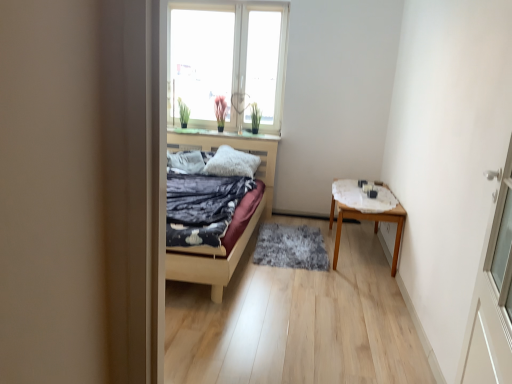
The image size is (512, 384). What do you see at coordinates (291, 247) in the screenshot? I see `gray shaggy rug at center` at bounding box center [291, 247].

The height and width of the screenshot is (384, 512). Describe the element at coordinates (232, 163) in the screenshot. I see `white fluffy pillow at center, positioned as the 2th pillow in left-to-right order` at that location.

Measure the distance between point (x=182, y=157) and camera.

4.59 meters.

Describe the element at coordinates (221, 134) in the screenshot. The width and height of the screenshot is (512, 384). I see `white glossy window sill at upper center` at that location.

Find the location of `gray shaggy rug at center`. gray shaggy rug at center is located at coordinates (291, 247).

Is white textured table at right not near white glossy window sill at upper center?

Yes, white textured table at right is far from white glossy window sill at upper center.

Where is `window sill above the white textured table at right (from a real-world perspective)`? window sill above the white textured table at right (from a real-world perspective) is located at coordinates (221, 134).

From a real-world perspective, is white glossy window sill at upper center located higher than gray shaggy rug at center?

Correct, in the physical world, white glossy window sill at upper center is higher than gray shaggy rug at center.

Considering the relative sizes of white glossy window sill at upper center and gray shaggy rug at center in the image provided, is white glossy window sill at upper center shorter than gray shaggy rug at center?

Yes, white glossy window sill at upper center is shorter than gray shaggy rug at center.

Based on their sizes in the image, would you say white glossy window sill at upper center is bigger or smaller than gray shaggy rug at center?

Clearly, white glossy window sill at upper center is smaller in size than gray shaggy rug at center.

Could you tell me if white glossy window sill at upper center is facing gray shaggy rug at center?

No, white glossy window sill at upper center is not facing towards gray shaggy rug at center.

Considering the positions of objects white fluffy pillow at center, arranged as the 1th pillow when viewed from the right, and white textured table at right in the image provided, who is more to the right, white fluffy pillow at center, arranged as the 1th pillow when viewed from the right, or white textured table at right?

white textured table at right.

Is point (231, 175) closer to viewer compared to point (349, 202)?

No.

Is white fluffy pillow at center, positioned as the 2th pillow in left-to-right order, positioned with its back to white textured table at right?

That's not correct — white fluffy pillow at center, positioned as the 2th pillow in left-to-right order, is not looking away from white textured table at right.

Is white fluffy pillow at center, arranged as the 1th pillow when viewed from the right, situated inside wooden table at right or outside?

white fluffy pillow at center, arranged as the 1th pillow when viewed from the right, is not enclosed by wooden table at right.

Does point (257, 167) appear closer or farther from the camera than point (404, 211)?

Point (257, 167) is farther from the camera than point (404, 211).

Between white fluffy pillow at center, arranged as the 1th pillow when viewed from the right, and wooden table at right, which one is positioned in front?

Positioned in front is wooden table at right.

From a real-world perspective, which object rests below the other?

From a 3D spatial view, wooden table at right is below.

Considering the relative sizes of wooden table at right and white fluffy pillow at center, positioned as the 2th pillow in left-to-right order, in the image provided, is wooden table at right thinner than white fluffy pillow at center, positioned as the 2th pillow in left-to-right order,?

No.

Locate an element on the screen. The width and height of the screenshot is (512, 384). pillow that is the 2nd one above the wooden table at right (from a real-world perspective) is located at coordinates (232, 163).

Considering the positions of objects white glossy window sill at upper center and white textured table at right in the image provided, who is more to the right, white glossy window sill at upper center or white textured table at right?

white textured table at right.

Where is `window sill above the white textured table at right (from a real-world perspective)`? window sill above the white textured table at right (from a real-world perspective) is located at coordinates (221, 134).

In the scene shown: Does white glossy window sill at upper center have a smaller size compared to white textured table at right?

Yes.

In the scene shown: Could you tell me if white glossy window sill at upper center is turned towards white textured table at right?

No.

How many degrees apart are the facing directions of transparent glass window at upper center and wooden table at right?

89.7 degrees.

From the image's perspective, is transparent glass window at upper center below wooden table at right?

Actually, transparent glass window at upper center appears above wooden table at right in the image.

Which of these two, transparent glass window at upper center or wooden table at right, stands shorter?

Standing shorter between the two is wooden table at right.

Locate an element on the screen. Image resolution: width=512 pixels, height=384 pixels. sheet on the right side of white glossy window sill at upper center is located at coordinates click(x=362, y=197).

Identify the location of mat below the white glossy window sill at upper center (from a real-world perspective). The height and width of the screenshot is (384, 512). (291, 247).

Estimate the real-world distances between objects in this image. Which object is further from transparent glass window at upper center, textured gray pillow at center, which is the 1th pillow in left-to-right order, or gray shaggy rug at center?

Among the two, gray shaggy rug at center is located further to transparent glass window at upper center.

Estimate the real-world distances between objects in this image. Which object is further from white textured table at right, gray shaggy rug at center or wooden table at right?

gray shaggy rug at center.

Looking at the image, which one is located closer to wooden table at right, white textured table at right or textured gray pillow at center, which is the 1th pillow in left-to-right order?

Based on the image, white textured table at right appears to be nearer to wooden table at right.

Based on their spatial positions, is white textured table at right or textured gray pillow at center, the 2th pillow viewed from the right, further from transparent glass window at upper center?

Based on the image, white textured table at right appears to be further to transparent glass window at upper center.

From the picture: Considering their positions, is textured gray pillow at center, the 2th pillow viewed from the right, positioned further to white fluffy pillow at center, positioned as the 2th pillow in left-to-right order, than white glossy window sill at upper center?

white glossy window sill at upper center is further to white fluffy pillow at center, positioned as the 2th pillow in left-to-right order.

Looking at the image, which one is located further to gray shaggy rug at center, textured gray pillow at center, the 2th pillow viewed from the right, or white glossy window sill at upper center?

white glossy window sill at upper center is further to gray shaggy rug at center.

Based on their spatial positions, is white glossy window sill at upper center or gray shaggy rug at center closer to white fluffy pillow at center, positioned as the 2th pillow in left-to-right order?

The object closer to white fluffy pillow at center, positioned as the 2th pillow in left-to-right order, is white glossy window sill at upper center.

From the image, which object appears to be nearer to wooden table at right, white textured table at right or gray shaggy rug at center?

white textured table at right lies closer to wooden table at right than the other object.

Locate an element on the screen. window sill between textured gray pillow at center, which is the 1th pillow in left-to-right order, and white textured table at right is located at coordinates (221, 134).

You are a GUI agent. You are given a task and a screenshot of the screen. Output one action in this format:
    pyautogui.click(x=<x>, y=<y>)
    Task: Click on the window sill between transparent glass window at upper center and wooden table at right from top to bottom
    
    Given the screenshot: What is the action you would take?
    pyautogui.click(x=221, y=134)

Find the location of a particular element. The width and height of the screenshot is (512, 384). pillow located between textured gray pillow at center, the 2th pillow viewed from the right, and wooden table at right in the left-right direction is located at coordinates coord(232,163).

Where is `mat situated between white fluffy pillow at center, positioned as the 2th pillow in left-to-right order, and wooden table at right from left to right`? The width and height of the screenshot is (512, 384). mat situated between white fluffy pillow at center, positioned as the 2th pillow in left-to-right order, and wooden table at right from left to right is located at coordinates (291, 247).